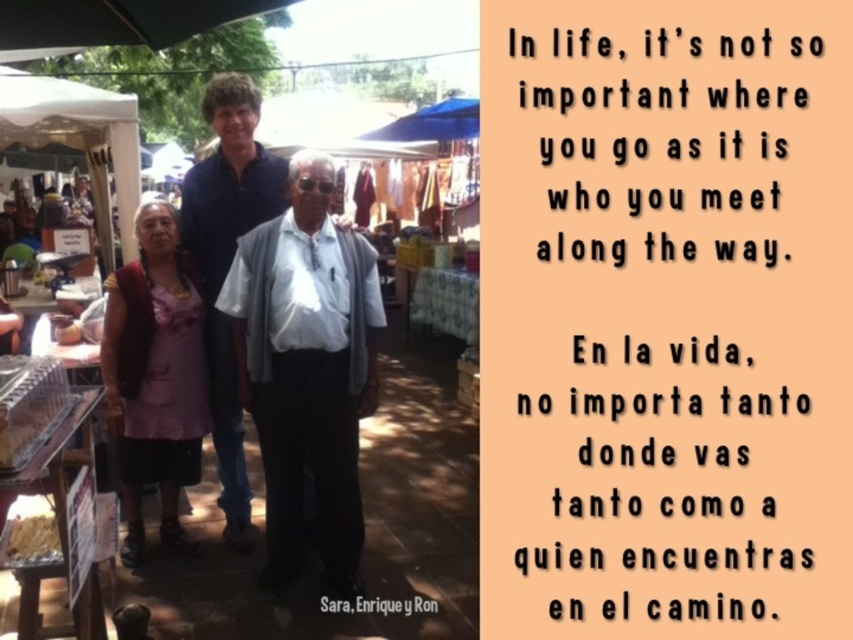
Is white matte shirt at center taller than pink fabric vest at left?

Indeed, white matte shirt at center has a greater height compared to pink fabric vest at left.

Image resolution: width=853 pixels, height=640 pixels. What do you see at coordinates (306, 369) in the screenshot? I see `white matte shirt at center` at bounding box center [306, 369].

This screenshot has height=640, width=853. I want to click on white matte shirt at center, so click(x=306, y=369).

Looking at this image, does white matte shirt at center appear on the right side of blue cotton shirt at center?

Indeed, white matte shirt at center is positioned on the right side of blue cotton shirt at center.

The image size is (853, 640). What do you see at coordinates (306, 369) in the screenshot?
I see `white matte shirt at center` at bounding box center [306, 369].

This screenshot has height=640, width=853. I want to click on white matte shirt at center, so click(306, 369).

Does pink fabric vest at left have a larger size compared to blue cotton shirt at center?

Incorrect, pink fabric vest at left is not larger than blue cotton shirt at center.

Does pink fabric vest at left appear on the right side of blue cotton shirt at center?

Incorrect, pink fabric vest at left is not on the right side of blue cotton shirt at center.

Identify the location of pink fabric vest at left. The height and width of the screenshot is (640, 853). (155, 376).

At what (x,y) coordinates should I click in order to perform the action: click on pink fabric vest at left. Please return your answer as a coordinate pair (x, y). Looking at the image, I should click on (155, 376).